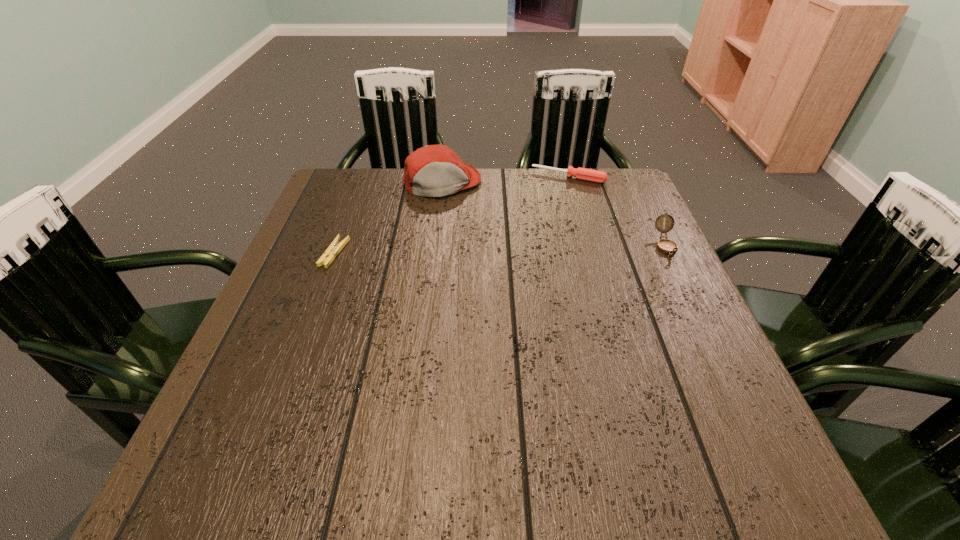
This screenshot has width=960, height=540. Find the location of `vacant area that satisfies the following two spatial constraints: 1. on the back side of the leftmost object; 2. on the right side of the third tallest object`. vacant area that satisfies the following two spatial constraints: 1. on the back side of the leftmost object; 2. on the right side of the third tallest object is located at coordinates (363, 177).